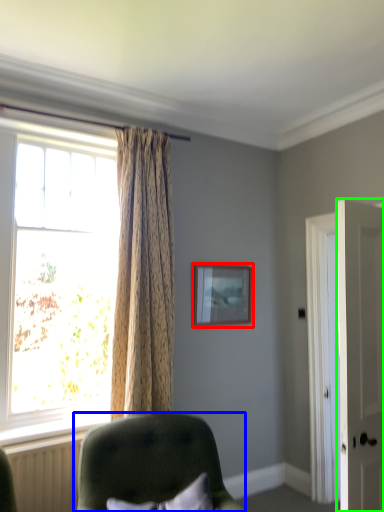
Question: Which is nearer to the picture frame (highlighted by a red box)? chair (highlighted by a blue box) or door (highlighted by a green box).

Choices:
 (A) chair
 (B) door

Answer: (A)